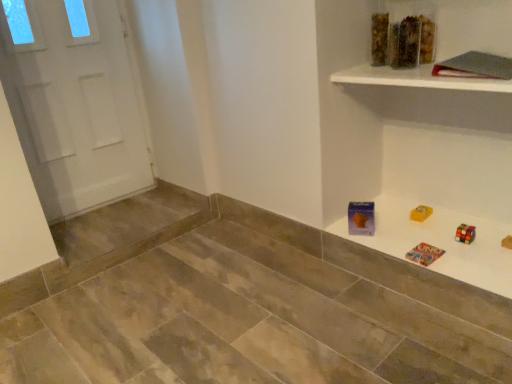
Question: From the image's perspective, is translucent plastic container at upper right, positioned as the 2th toy in right-to-left order, on translucent plastic container at upper center?

Choices:
 (A) no
 (B) yes

Answer: (A)

Question: Considering the relative positions of translucent plastic container at upper right, positioned as the 2th toy in right-to-left order, and translucent plastic container at upper center in the image provided, is translucent plastic container at upper right, positioned as the 2th toy in right-to-left order, behind translucent plastic container at upper center?

Choices:
 (A) no
 (B) yes

Answer: (A)

Question: Is translucent plastic container at upper right, which appears as the 1th toy when viewed from the left, positioned with its back to translucent plastic container at upper center?

Choices:
 (A) yes
 (B) no

Answer: (B)

Question: Does translucent plastic container at upper right, which appears as the 1th toy when viewed from the left, have a lesser width compared to translucent plastic container at upper center?

Choices:
 (A) no
 (B) yes

Answer: (B)

Question: Is the depth of translucent plastic container at upper right, which appears as the 1th toy when viewed from the left, less than that of translucent plastic container at upper center?

Choices:
 (A) no
 (B) yes

Answer: (B)

Question: Can you confirm if translucent plastic container at upper right, which appears as the 1th toy when viewed from the left, is taller than translucent plastic container at upper center?

Choices:
 (A) no
 (B) yes

Answer: (A)

Question: Is multicolored plastic puzzle at upper right oriented towards translucent plastic container at upper right, which appears as the 1th toy when viewed from the left?

Choices:
 (A) no
 (B) yes

Answer: (A)

Question: Is multicolored plastic puzzle at upper right shorter than translucent plastic container at upper right, which appears as the 1th toy when viewed from the left?

Choices:
 (A) yes
 (B) no

Answer: (A)

Question: Considering the relative positions of multicolored plastic puzzle at upper right and translucent plastic container at upper right, positioned as the 2th toy in right-to-left order, in the image provided, is multicolored plastic puzzle at upper right behind translucent plastic container at upper right, positioned as the 2th toy in right-to-left order,?

Choices:
 (A) no
 (B) yes

Answer: (A)

Question: Considering the relative positions of multicolored plastic puzzle at upper right and translucent plastic container at upper right, which appears as the 1th toy when viewed from the left, in the image provided, is multicolored plastic puzzle at upper right to the left of translucent plastic container at upper right, which appears as the 1th toy when viewed from the left, from the viewer's perspective?

Choices:
 (A) yes
 (B) no

Answer: (B)

Question: From the image's perspective, is multicolored plastic puzzle at upper right located beneath translucent plastic container at upper right, which appears as the 1th toy when viewed from the left?

Choices:
 (A) no
 (B) yes

Answer: (B)

Question: Is multicolored plastic puzzle at upper right far from translucent plastic container at upper right, which appears as the 1th toy when viewed from the left?

Choices:
 (A) yes
 (B) no

Answer: (B)

Question: Is translucent plastic container at upper right, which is the first toy in right-to-left order, positioned in front of white glossy shelf at upper right?

Choices:
 (A) no
 (B) yes

Answer: (A)